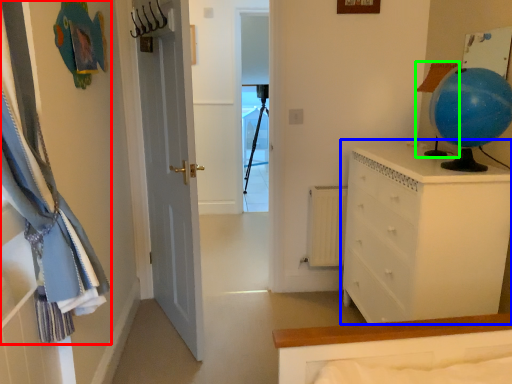
Question: Estimate the real-world distances between objects in this image. Which object is closer to curtain (highlighted by a red box), chest of drawers (highlighted by a blue box) or lamp (highlighted by a green box)?

Choices:
 (A) chest of drawers
 (B) lamp

Answer: (A)